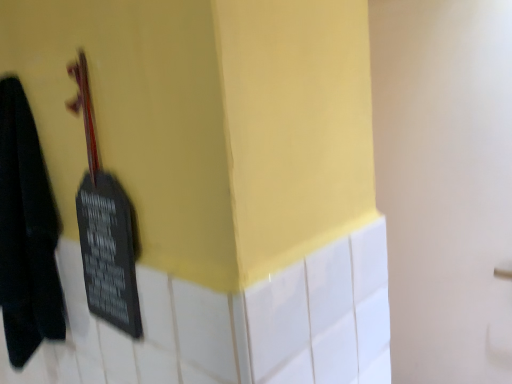
Question: Does black matte violin at left have a larger size compared to black matte towel at left?

Choices:
 (A) yes
 (B) no

Answer: (B)

Question: From a real-world perspective, is black matte violin at left on black matte towel at left?

Choices:
 (A) yes
 (B) no

Answer: (A)

Question: From the image's perspective, is black matte violin at left beneath black matte towel at left?

Choices:
 (A) yes
 (B) no

Answer: (B)

Question: Can you confirm if black matte violin at left is wider than black matte towel at left?

Choices:
 (A) no
 (B) yes

Answer: (A)

Question: Are black matte violin at left and black matte towel at left beside each other?

Choices:
 (A) yes
 (B) no

Answer: (B)

Question: Is black matte towel at left at the back of black matte violin at left?

Choices:
 (A) yes
 (B) no

Answer: (B)

Question: Is black matte towel at left turned away from black matte violin at left?

Choices:
 (A) no
 (B) yes

Answer: (A)

Question: Are black matte towel at left and black matte violin at left beside each other?

Choices:
 (A) no
 (B) yes

Answer: (A)

Question: Is black matte towel at left taller than black matte violin at left?

Choices:
 (A) no
 (B) yes

Answer: (B)

Question: Considering the relative sizes of black matte towel at left and black matte violin at left in the image provided, is black matte towel at left bigger than black matte violin at left?

Choices:
 (A) no
 (B) yes

Answer: (B)

Question: Can you confirm if black matte towel at left is smaller than black matte violin at left?

Choices:
 (A) yes
 (B) no

Answer: (B)

Question: Does black matte towel at left appear on the left side of black matte violin at left?

Choices:
 (A) no
 (B) yes

Answer: (B)

Question: From a real-world perspective, is black matte towel at left positioned above or below black matte violin at left?

Choices:
 (A) above
 (B) below

Answer: (B)